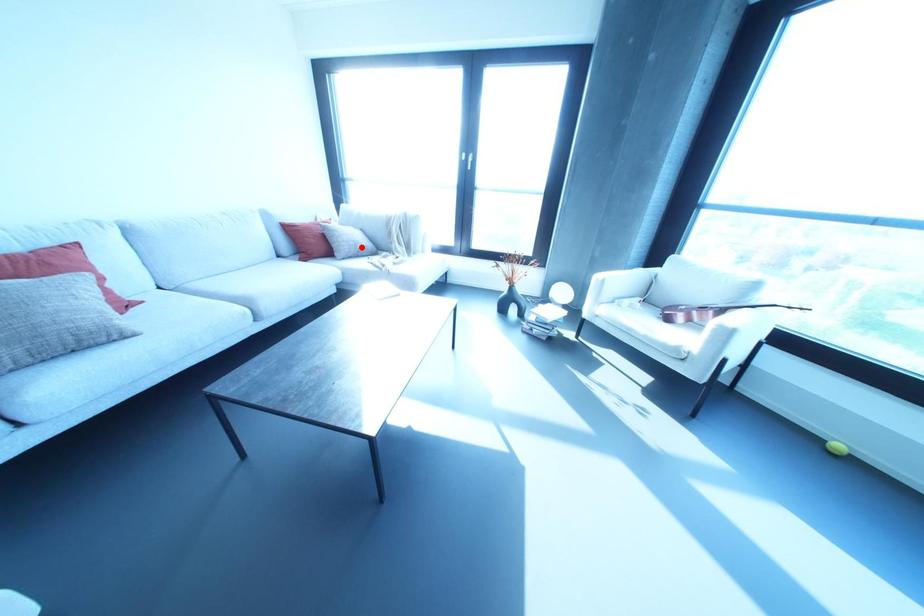
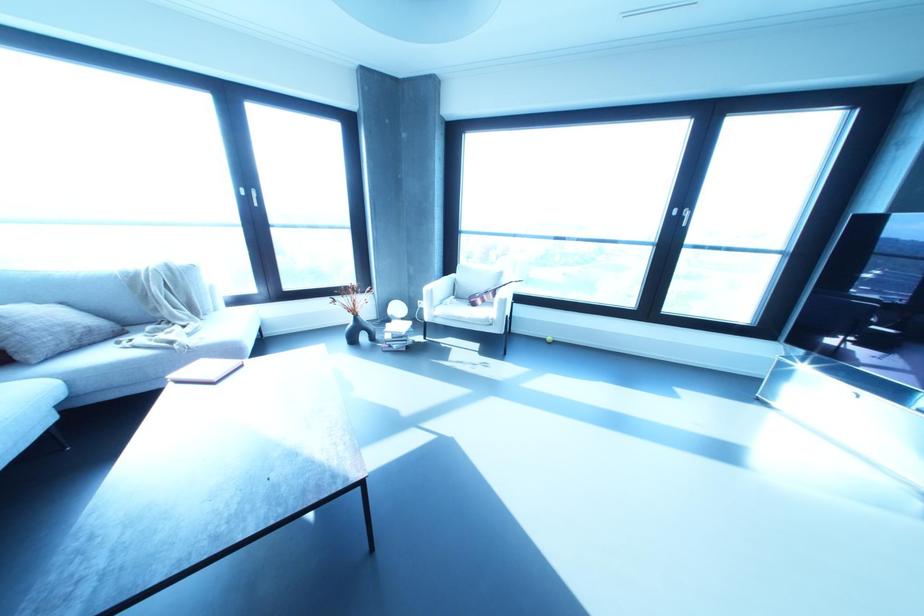
Question: I am providing you with two images of the same scene from different viewpoints. Given a red point in image1, look at the same physical point in image2. Is it:

Choices:
 (A) Closer to the viewpoint
 (B) Farther from the viewpoint

Answer: (B)